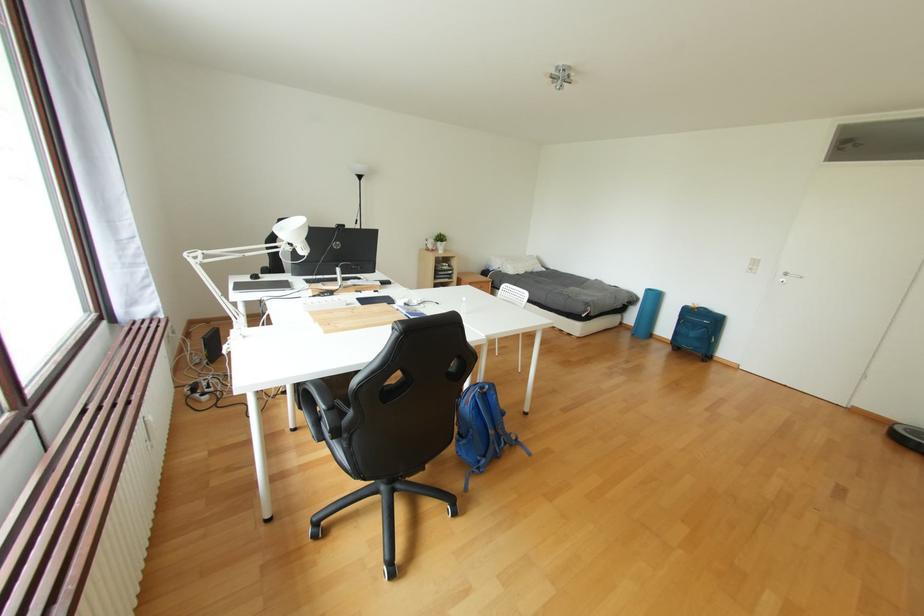
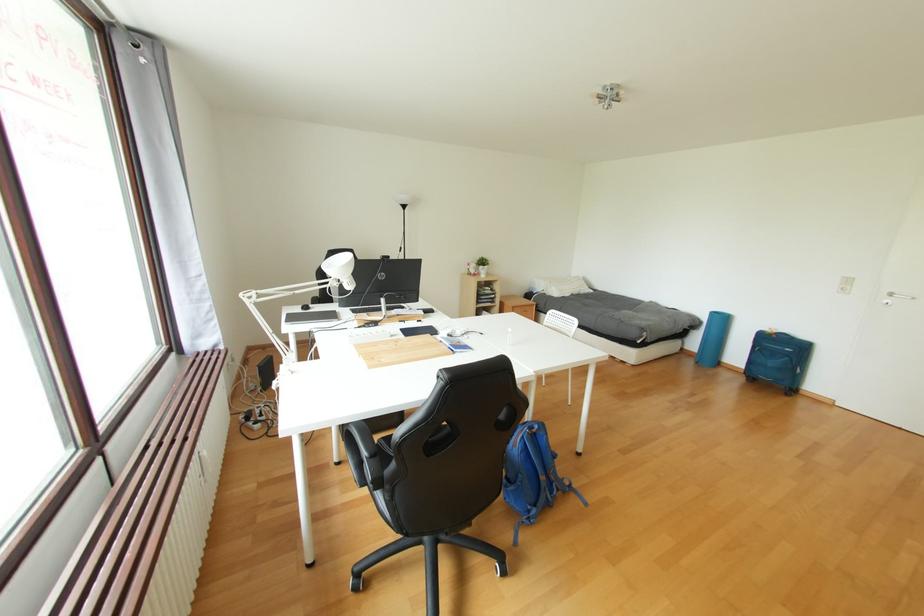
Question: Based on the continuous images, in which direction is the camera rotating? Reply with the corresponding letter.

Choices:
 (A) Left
 (B) Right
 (C) Up
 (D) Down

Answer: (A)